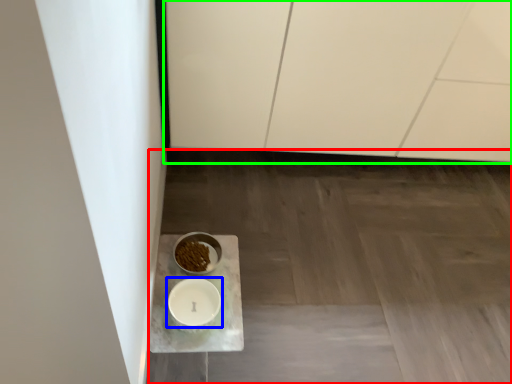
Question: Which object is positioned farthest from concrete (highlighted by a red box)? Select from tableware (highlighted by a blue box) and cabinetry (highlighted by a green box).

Choices:
 (A) tableware
 (B) cabinetry

Answer: (A)